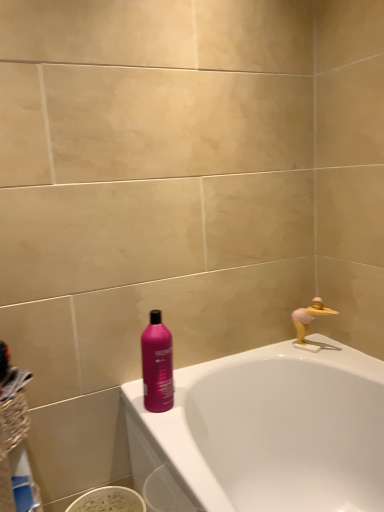
Image resolution: width=384 pixels, height=512 pixels. Describe the element at coordinates (157, 365) in the screenshot. I see `matte pink bottle at center` at that location.

Image resolution: width=384 pixels, height=512 pixels. Describe the element at coordinates (308, 320) in the screenshot. I see `yellow rubber duck at upper right` at that location.

Locate an element on the screen. The image size is (384, 512). yellow rubber duck at upper right is located at coordinates (308, 320).

Consider the image. Measure the distance between blue plastic bottle at lower left and camera.

A distance of 38.70 inches exists between blue plastic bottle at lower left and camera.

Identify the location of white glossy bathtub at upper right. (269, 430).

How far apart are matte pink bottle at center and yellow rubber duck at upper right?

A distance of 21.11 inches exists between matte pink bottle at center and yellow rubber duck at upper right.

How many degrees apart are the facing directions of matte pink bottle at center and yellow rubber duck at upper right?

matte pink bottle at center and yellow rubber duck at upper right are facing 29.3 degrees away from each other.

From a real-world perspective, who is located higher, matte pink bottle at center or yellow rubber duck at upper right?

In real-world perspective, matte pink bottle at center is above.

Can you confirm if matte pink bottle at center is wider than yellow rubber duck at upper right?

Yes, matte pink bottle at center is wider than yellow rubber duck at upper right.

From the image's perspective, is blue plastic bottle at lower left under white glossy bathtub at upper right?

Actually, blue plastic bottle at lower left appears above white glossy bathtub at upper right in the image.

In the image, is blue plastic bottle at lower left on the left side or the right side of white glossy bathtub at upper right?

blue plastic bottle at lower left is positioned on white glossy bathtub at upper right's left side.

Is blue plastic bottle at lower left facing away from white glossy bathtub at upper right?

No, blue plastic bottle at lower left is not facing away from white glossy bathtub at upper right.

Which of these two, blue plastic bottle at lower left or white glossy bathtub at upper right, is wider?

white glossy bathtub at upper right.

How far apart are white glossy bathtub at upper right and yellow rubber duck at upper right?

white glossy bathtub at upper right is 12.17 inches from yellow rubber duck at upper right.

How many degrees apart are the facing directions of white glossy bathtub at upper right and yellow rubber duck at upper right?

white glossy bathtub at upper right and yellow rubber duck at upper right are facing 27.3 degrees away from each other.

Is the depth of white glossy bathtub at upper right greater than that of yellow rubber duck at upper right?

No, the depth of white glossy bathtub at upper right is less than that of yellow rubber duck at upper right.

Considering the sizes of white glossy bathtub at upper right and yellow rubber duck at upper right in the image, is white glossy bathtub at upper right taller or shorter than yellow rubber duck at upper right?

Considering their sizes, white glossy bathtub at upper right has more height than yellow rubber duck at upper right.

Which is behind, point (11, 477) or point (302, 309)?

The point (302, 309) is more distant.

Can you confirm if blue plastic bottle at lower left is positioned to the right of yellow rubber duck at upper right?

No.

Between blue plastic bottle at lower left and yellow rubber duck at upper right, which one has larger size?

With larger size is yellow rubber duck at upper right.

Is yellow rubber duck at upper right at the back of blue plastic bottle at lower left?

No, yellow rubber duck at upper right is not at the back of blue plastic bottle at lower left.

From a real-world perspective, is matte pink bottle at center positioned above or below blue plastic bottle at lower left?

In terms of real-world spatial position, matte pink bottle at center is above blue plastic bottle at lower left.

Between matte pink bottle at center and blue plastic bottle at lower left, which one has larger size?

With larger size is matte pink bottle at center.

You are a GUI agent. You are given a task and a screenshot of the screen. Output one action in this format:
    pyautogui.click(x=<x>, y=<y>)
    Task: Click on the bottle located above the blue plastic bottle at lower left (from a real-world perspective)
    This screenshot has height=512, width=384.
    Given the screenshot: What is the action you would take?
    pyautogui.click(x=157, y=365)

How many degrees apart are the facing directions of matte pink bottle at center and blue plastic bottle at lower left?

The angular difference between matte pink bottle at center and blue plastic bottle at lower left is 110 degrees.

Locate an element on the screen. Image resolution: width=384 pixels, height=512 pixels. bottle to the left of white glossy bathtub at upper right is located at coordinates (157, 365).

Between matte pink bottle at center and white glossy bathtub at upper right, which one has larger size?

white glossy bathtub at upper right.

Could you tell me if matte pink bottle at center is turned towards white glossy bathtub at upper right?

No.

Is matte pink bottle at center placed right next to white glossy bathtub at upper right?

matte pink bottle at center and white glossy bathtub at upper right are not in contact.

Between yellow rubber duck at upper right and matte pink bottle at center, which one has more height?

matte pink bottle at center is taller.

From the image's perspective, which one is positioned higher, yellow rubber duck at upper right or matte pink bottle at center?

yellow rubber duck at upper right.

You are a GUI agent. You are given a task and a screenshot of the screen. Output one action in this format:
    pyautogui.click(x=<x>, y=<y>)
    Task: Click on the bottle in front of the yellow rubber duck at upper right
    
    Given the screenshot: What is the action you would take?
    pyautogui.click(x=157, y=365)

Is matte pink bottle at center surrounded by yellow rubber duck at upper right?

That's incorrect, matte pink bottle at center is not inside yellow rubber duck at upper right.

Locate an element on the screen. bottle lying in front of the yellow rubber duck at upper right is located at coordinates (157, 365).

Where is `bathtub below the blue plastic bottle at lower left (from a real-world perspective)`? bathtub below the blue plastic bottle at lower left (from a real-world perspective) is located at coordinates (269, 430).

Estimate the real-world distances between objects in this image. Which object is closer to blue plastic bottle at lower left, matte pink bottle at center or yellow rubber duck at upper right?

matte pink bottle at center is closer to blue plastic bottle at lower left.

From the picture: From the image, which object appears to be nearer to yellow rubber duck at upper right, white glossy bathtub at upper right or blue plastic bottle at lower left?

Based on the image, white glossy bathtub at upper right appears to be nearer to yellow rubber duck at upper right.

From the image, which object appears to be farther from blue plastic bottle at lower left, matte pink bottle at center or white glossy bathtub at upper right?

white glossy bathtub at upper right is further to blue plastic bottle at lower left.

Consider the image. Considering their positions, is matte pink bottle at center positioned further to white glossy bathtub at upper right than blue plastic bottle at lower left?

blue plastic bottle at lower left is positioned further to the anchor white glossy bathtub at upper right.

Which object lies nearer to the anchor point blue plastic bottle at lower left, white glossy bathtub at upper right or matte pink bottle at center?

matte pink bottle at center is closer to blue plastic bottle at lower left.

In the scene shown: Based on their spatial positions, is yellow rubber duck at upper right or white glossy bathtub at upper right further from blue plastic bottle at lower left?

yellow rubber duck at upper right.

Estimate the real-world distances between objects in this image. Which object is further from white glossy bathtub at upper right, matte pink bottle at center or yellow rubber duck at upper right?

matte pink bottle at center.

Based on their spatial positions, is yellow rubber duck at upper right or blue plastic bottle at lower left closer to white glossy bathtub at upper right?

Among the two, yellow rubber duck at upper right is located nearer to white glossy bathtub at upper right.

This screenshot has height=512, width=384. Identify the location of bottle between white glossy bathtub at upper right and yellow rubber duck at upper right from front to back. (157, 365).

The height and width of the screenshot is (512, 384). In order to click on bottle located between blue plastic bottle at lower left and white glossy bathtub at upper right in the left-right direction in this screenshot , I will do `click(157, 365)`.

Find the location of a particular element. Image resolution: width=384 pixels, height=512 pixels. bathtub between blue plastic bottle at lower left and yellow rubber duck at upper right is located at coordinates (269, 430).

You are a GUI agent. You are given a task and a screenshot of the screen. Output one action in this format:
    pyautogui.click(x=<x>, y=<y>)
    Task: Click on the bottle situated between blue plastic bottle at lower left and yellow rubber duck at upper right from left to right
    The width and height of the screenshot is (384, 512).
    Given the screenshot: What is the action you would take?
    pyautogui.click(x=157, y=365)